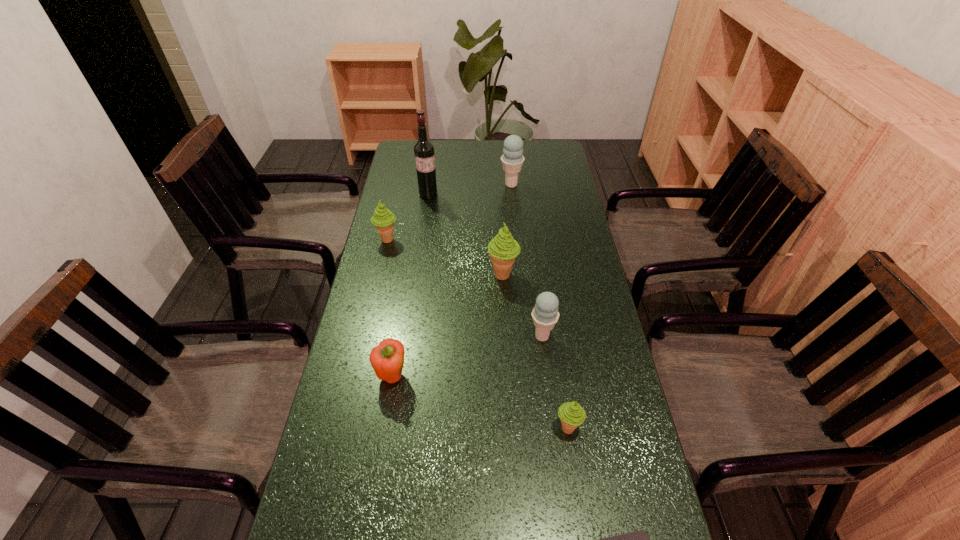
Find the location of `unoccupied position between the bigger blue ice cream and the tallest object`. unoccupied position between the bigger blue ice cream and the tallest object is located at coordinates (469, 190).

Identify the location of free space between the nearer blue ice cream and the wine bottle. (485, 265).

Select which object appears as the seventh closest to the smallest green icecream. Please provide its 2D coordinates. Your answer should be formatted as a tuple, i.e. [(x, y)], where the tuple contains the x and y coordinates of a point satisfying the conditions above.

[(423, 149)]

The height and width of the screenshot is (540, 960). I want to click on object that ranks as the seventh closest to the farther blue ice cream, so coord(640,539).

I want to click on icecream that stands as the third closest to the second farthest green icecream, so click(x=512, y=159).

Locate which icecream is the closest to the bigger blue ice cream. Please provide its 2D coordinates. Your answer should be formatted as a tuple, i.e. [(x, y)], where the tuple contains the x and y coordinates of a point satisfying the conditions above.

[(503, 249)]

Identify which green icecream is located as the second nearest to the farthest icecream. Please provide its 2D coordinates. Your answer should be formatted as a tuple, i.e. [(x, y)], where the tuple contains the x and y coordinates of a point satisfying the conditions above.

[(383, 219)]

Locate an element on the screen. green icecream that stands as the third closest to the nearer blue ice cream is located at coordinates (383, 219).

This screenshot has height=540, width=960. Find the location of `vacant space that satisfies the following two spatial constraints: 1. on the front and back of the wine bottle; 2. on the right side of the second green icecream from left to right`. vacant space that satisfies the following two spatial constraints: 1. on the front and back of the wine bottle; 2. on the right side of the second green icecream from left to right is located at coordinates (417, 275).